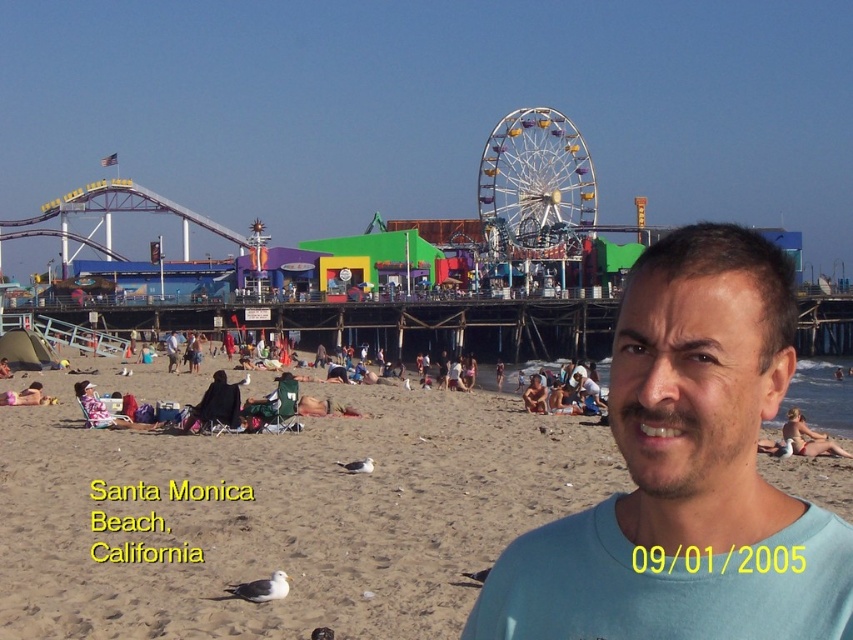
Is beige sand at lower center bigger than light blue t-shirt at center?

Correct, beige sand at lower center is larger in size than light blue t-shirt at center.

Is beige sand at lower center taller than light blue t-shirt at center?

No.

Identify the location of beige sand at lower center. The width and height of the screenshot is (853, 640). (279, 513).

Looking at this image, between light blue t-shirt at center and yellow metallic ferris wheel at center, which one appears on the left side from the viewer's perspective?

From the viewer's perspective, yellow metallic ferris wheel at center appears more on the left side.

Does light blue t-shirt at center appear over yellow metallic ferris wheel at center?

No.

Identify the location of light blue t-shirt at center. (686, 474).

Can you confirm if beige sand at lower center is smaller than yellow metallic ferris wheel at center?

Incorrect, beige sand at lower center is not smaller in size than yellow metallic ferris wheel at center.

Is beige sand at lower center bigger than yellow metallic ferris wheel at center?

Answer: Correct, beige sand at lower center is larger in size than yellow metallic ferris wheel at center.

Who is more forward, (267, 604) or (556, 209)?

Point (267, 604) is in front.

At what (x,y) coordinates should I click in order to perform the action: click on beige sand at lower center. Please return your answer as a coordinate pair (x, y). The image size is (853, 640). Looking at the image, I should click on (279, 513).